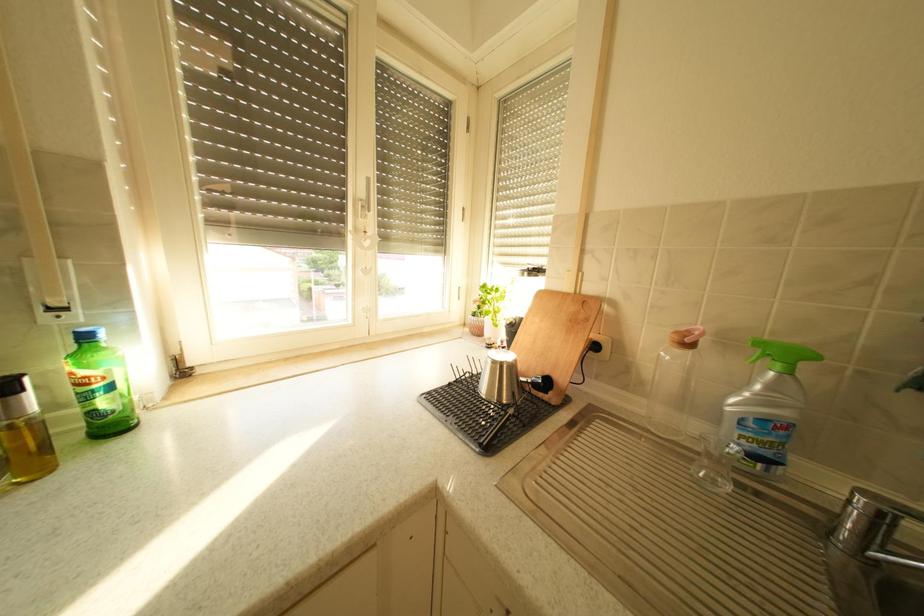
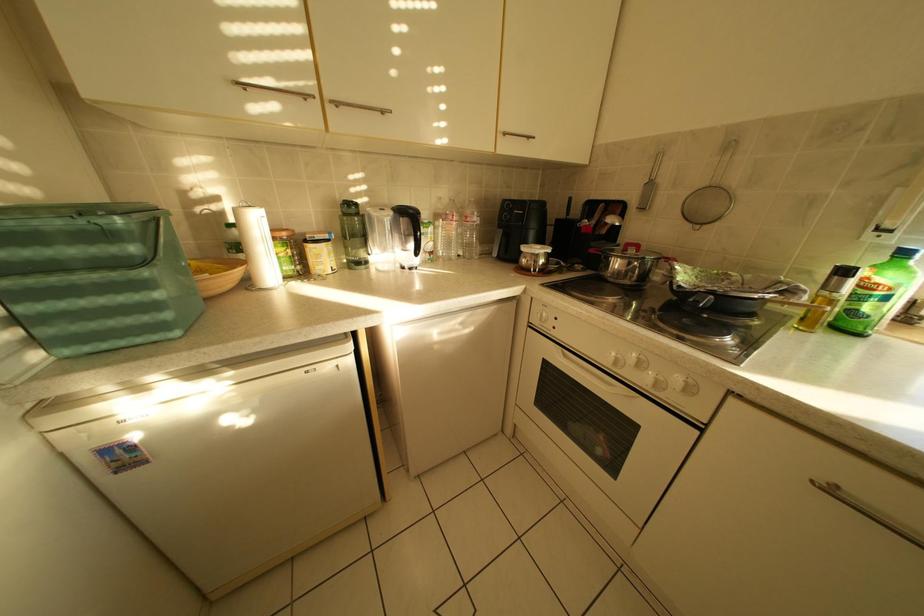
The first image is from the beginning of the video and the second image is from the end. How did the camera likely rotate when shooting the video?

The camera rotated toward left-down.